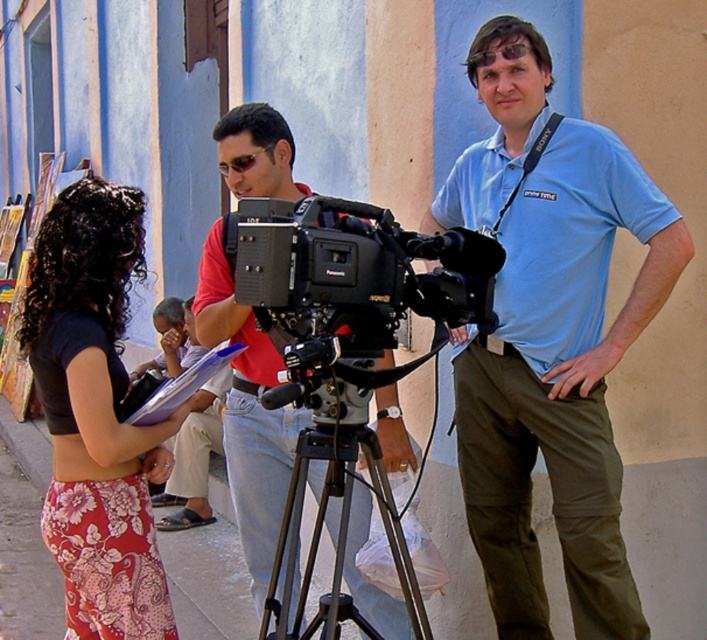
You are standing in front of the video camera and want to focus on two points marked in the scene. Which point, point (259, 522) or point (286, 262), is closer to the camera?

Point (259, 522) is further to the camera than point (286, 262), so the closer point to the camera is point (286, 262).

You are standing in the scene and want to move from the point at coordinates point [498,477] to the point at coordinates point [58,285]. Which direction should you move to get closer to the latter?

You should move towards the lower left direction since point [58,285] is closer to the viewer compared to point [498,477].